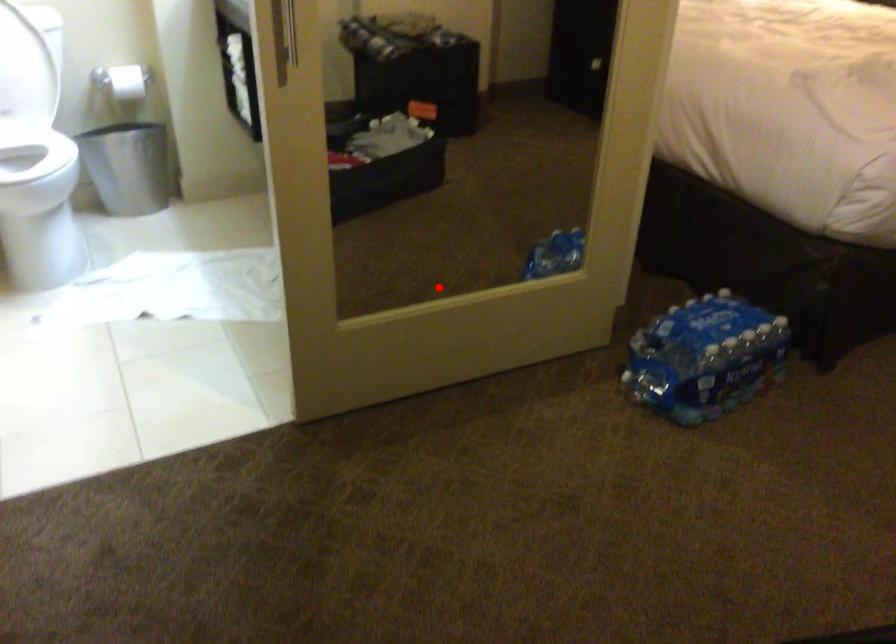
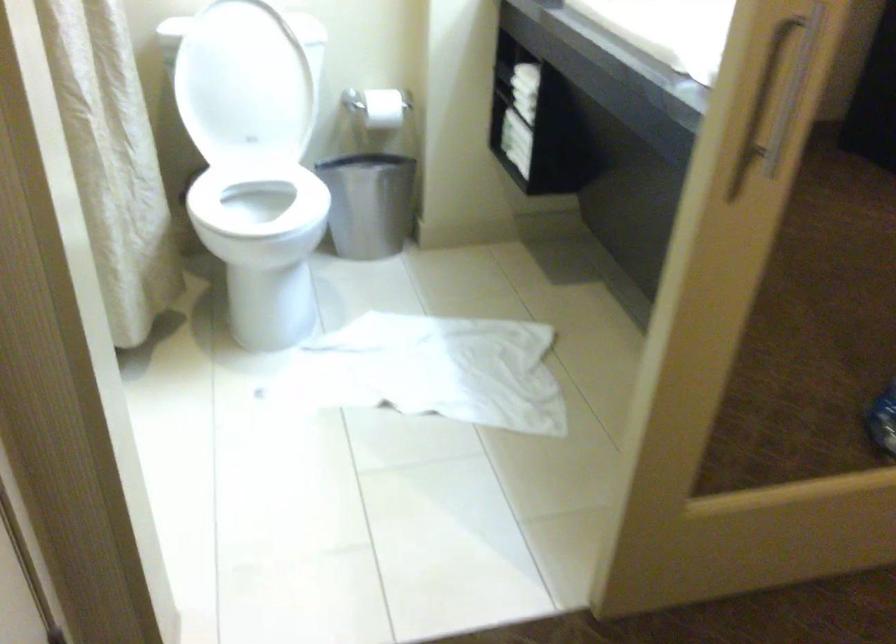
Locate, in the second image, the point that corresponds to the highlighted location in the first image.

(754, 422)